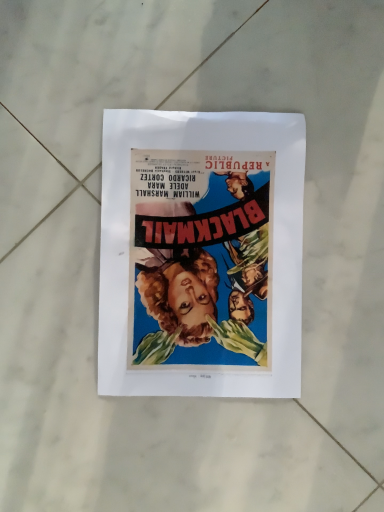
Measure the distance between point (285, 390) and camera.

Point (285, 390) is 17.44 inches away from camera.

This screenshot has height=512, width=384. I want to click on matte paper poster at center, so click(201, 254).

Describe the element at coordinates (201, 254) in the screenshot. This screenshot has width=384, height=512. I see `matte paper poster at center` at that location.

Find the location of a particular element. matte paper poster at center is located at coordinates (201, 254).